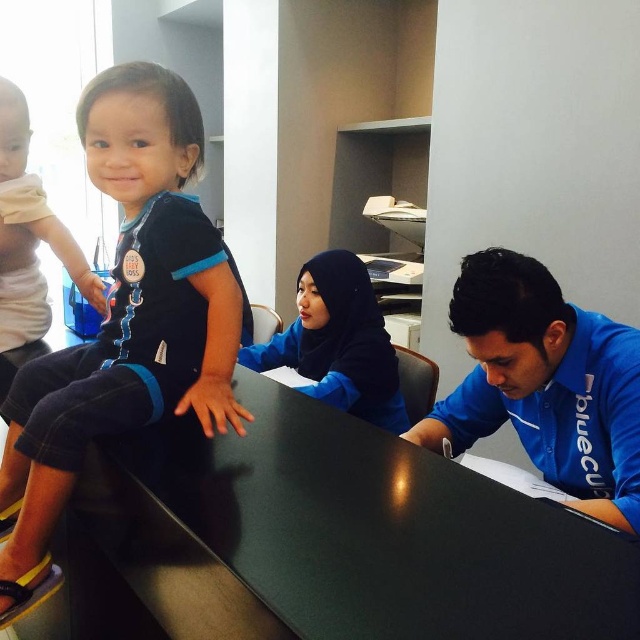
Question: In this image, where is black smooth table at center located relative to matte black shirt at center?

Choices:
 (A) left
 (B) right

Answer: (B)

Question: Which point appears farthest from the camera in this image?

Choices:
 (A) (6, 99)
 (B) (129, 298)
 (C) (372, 376)
 (D) (515, 406)

Answer: (C)

Question: Among these objects, which one is farthest from the camera?

Choices:
 (A) matte black shirt at center
 (B) matte black shirt at upper left
 (C) blue matte hijab at center
 (D) black smooth table at center

Answer: (C)

Question: Which object is the closest to the matte black shirt at center?

Choices:
 (A) black smooth table at center
 (B) matte black shirt at upper left

Answer: (B)

Question: Considering the relative positions of matte black shirt at upper left and blue cotton shirt at center in the image provided, where is matte black shirt at upper left located with respect to blue cotton shirt at center?

Choices:
 (A) left
 (B) right

Answer: (A)

Question: Is blue matte hijab at center positioned in front of matte black shirt at center?

Choices:
 (A) yes
 (B) no

Answer: (B)